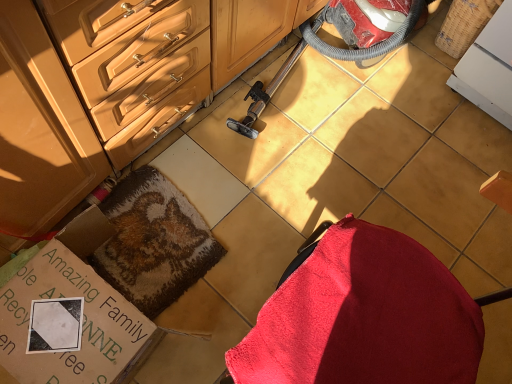
Find the location of `vacant area on top of fluffy brown rug at center (from a real-world perspective)`. vacant area on top of fluffy brown rug at center (from a real-world perspective) is located at coordinates (x=144, y=240).